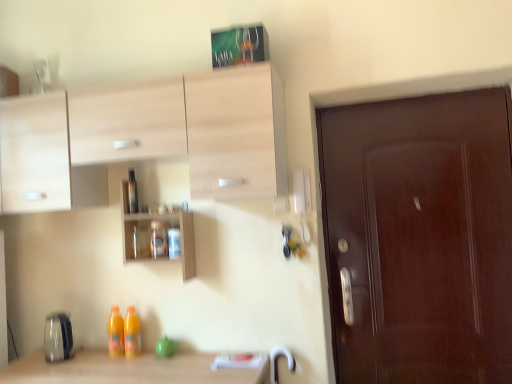
Question: From a real-world perspective, is translucent glass jar at center, placed as the second bottle when sorted from top to bottom, physically below transparent plastic bottle at center, the second bottle ordered from the bottom?

Choices:
 (A) no
 (B) yes

Answer: (B)

Question: Is the position of translucent glass jar at center, placed as the second bottle when sorted from top to bottom, less distant than that of transparent plastic bottle at center, the second bottle ordered from the bottom?

Choices:
 (A) yes
 (B) no

Answer: (A)

Question: Is the position of translucent glass jar at center, the first bottle in the right-to-left sequence, more distant than that of transparent plastic bottle at center, the second bottle positioned from the right?

Choices:
 (A) yes
 (B) no

Answer: (B)

Question: Is translucent glass jar at center, the first bottle in the right-to-left sequence, placed right next to transparent plastic bottle at center, the second bottle ordered from the bottom?

Choices:
 (A) yes
 (B) no

Answer: (B)

Question: Is translucent glass jar at center, placed as the 1th bottle when sorted from bottom to top, oriented away from transparent plastic bottle at center, the second bottle ordered from the bottom?

Choices:
 (A) yes
 (B) no

Answer: (B)

Question: Is transparent plastic bottle at center, the 1th bottle in the left-to-right sequence, situated inside wooden shelves at center or outside?

Choices:
 (A) inside
 (B) outside

Answer: (A)

Question: From the image's perspective, is transparent plastic bottle at center, the second bottle positioned from the right, above or below wooden shelves at center?

Choices:
 (A) above
 (B) below

Answer: (A)

Question: In the image, is transparent plastic bottle at center, the 1th bottle in the left-to-right sequence, on the left side or the right side of wooden shelves at center?

Choices:
 (A) left
 (B) right

Answer: (A)

Question: Looking at their shapes, would you say transparent plastic bottle at center, the 1th bottle in the left-to-right sequence, is wider or thinner than wooden shelves at center?

Choices:
 (A) thin
 (B) wide

Answer: (A)

Question: Is wooden shelves at center in front of or behind translucent glass jar at center, the first bottle in the right-to-left sequence, in the image?

Choices:
 (A) front
 (B) behind

Answer: (A)

Question: Choose the correct answer: Is wooden shelves at center inside translucent glass jar at center, placed as the 1th bottle when sorted from bottom to top, or outside it?

Choices:
 (A) outside
 (B) inside

Answer: (A)

Question: Would you say wooden shelves at center is to the left or to the right of translucent glass jar at center, which ranks as the second bottle in left-to-right order, in the picture?

Choices:
 (A) right
 (B) left

Answer: (B)

Question: Considering the positions of point (152, 258) and point (156, 254), is point (152, 258) closer or farther from the camera than point (156, 254)?

Choices:
 (A) closer
 (B) farther

Answer: (B)

Question: Is wooden shelves at center in front of or behind transparent plastic bottle at center, the 1th bottle in the left-to-right sequence, in the image?

Choices:
 (A) front
 (B) behind

Answer: (A)

Question: Is point (150, 230) positioned closer to the camera than point (129, 198)?

Choices:
 (A) closer
 (B) farther

Answer: (A)